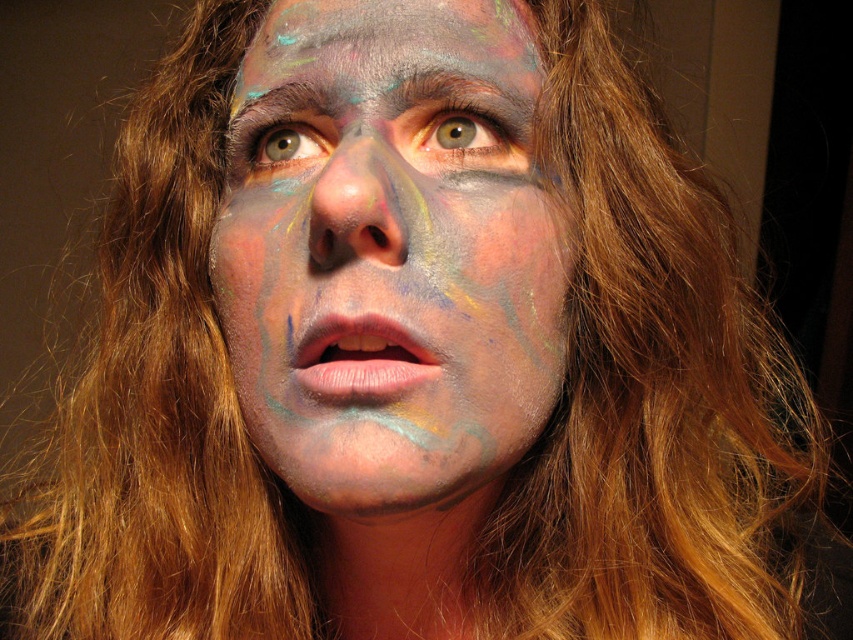
From the picture: Is multicolored paint at center shorter than matte green eye at center?

Incorrect, multicolored paint at center's height does not fall short of matte green eye at center's.

Does multicolored paint at center appear on the right side of matte green eye at center?

No, multicolored paint at center is not to the right of matte green eye at center.

Which is in front, point (238, 324) or point (432, 116)?

Positioned in front is point (432, 116).

At what (x,y) coordinates should I click in order to perform the action: click on multicolored paint at center. Please return your answer as a coordinate pair (x, y). The image size is (853, 640). Looking at the image, I should click on click(390, 257).

Based on the photo, is multicolored paint at center to the left of matte multicolored face paint at center from the viewer's perspective?

In fact, multicolored paint at center is to the right of matte multicolored face paint at center.

Can you confirm if multicolored paint at center is bigger than matte multicolored face paint at center?

Yes, multicolored paint at center is bigger than matte multicolored face paint at center.

Find the location of a particular element. This screenshot has width=853, height=640. multicolored paint at center is located at coordinates (390, 257).

This screenshot has width=853, height=640. Identify the location of multicolored paint at center. (390, 257).

Does point (442, 131) lie in front of point (318, 141)?

Yes, it is.

How much distance is there between matte green eye at center and matte multicolored face paint at center?

The distance of matte green eye at center from matte multicolored face paint at center is 4.87 centimeters.

Locate an element on the screen. The image size is (853, 640). matte green eye at center is located at coordinates (463, 131).